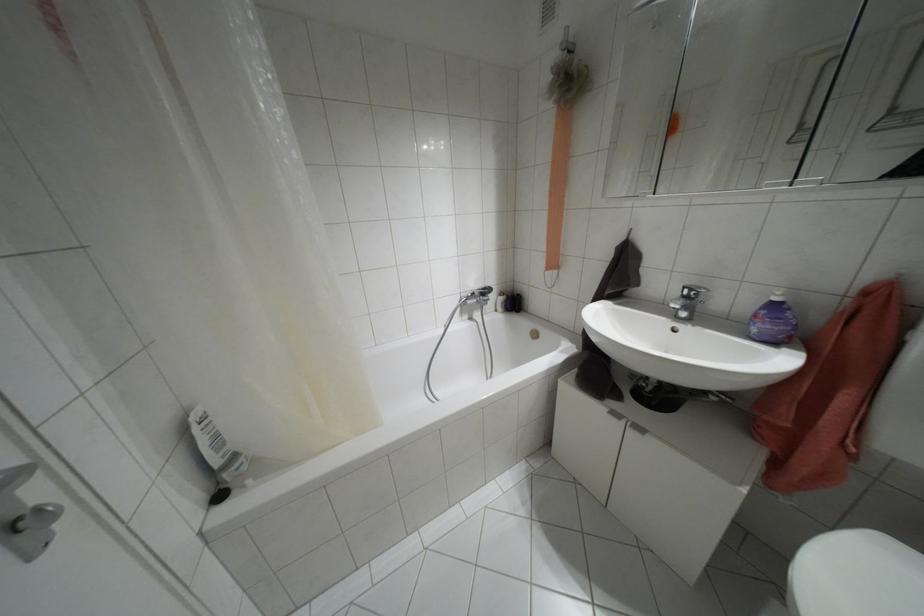
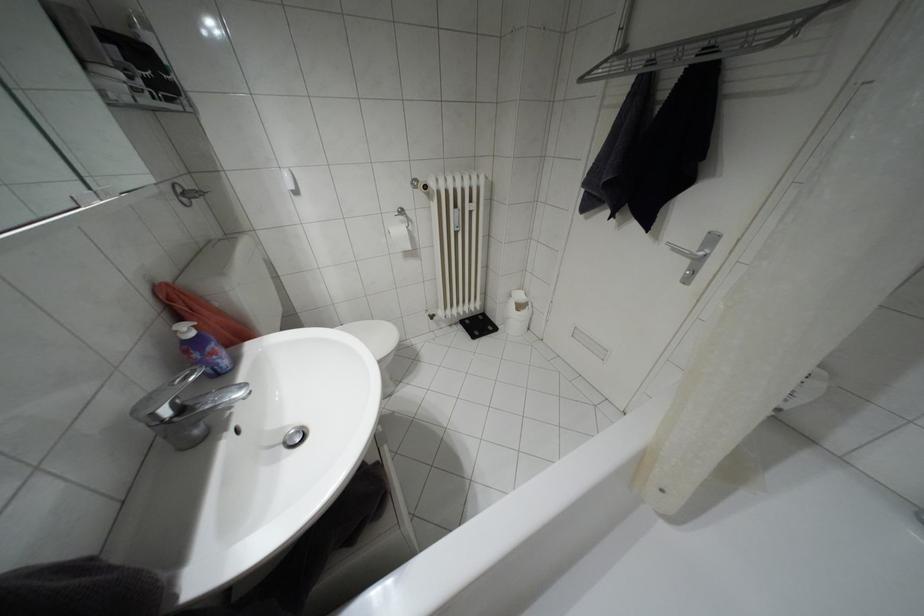
Locate, in the second image, the point that corresponds to pixel 774 299 in the first image.

(190, 333)